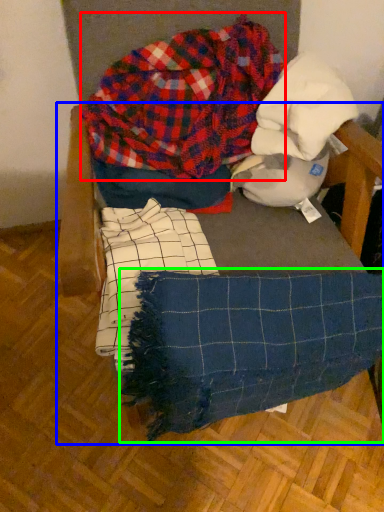
Question: Based on their relative distances, which object is farther from flannel (highlighted by a red box)? Choose from furniture (highlighted by a blue box) and blanket (highlighted by a green box).

Choices:
 (A) furniture
 (B) blanket

Answer: (B)